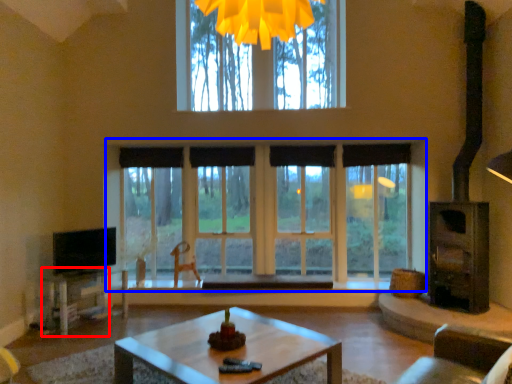
Question: Which point is closer to the camera, table (highlighted by a red box) or window (highlighted by a blue box)?

Choices:
 (A) table
 (B) window

Answer: (A)